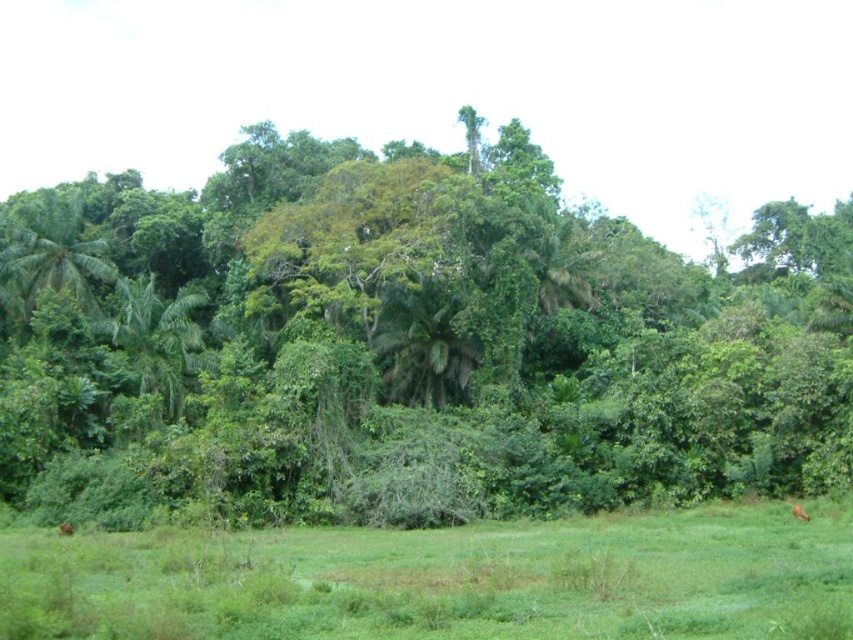
Question: Which of the following is the farthest from the observer?

Choices:
 (A) green grassy field at lower center
 (B) green leafy tree at center

Answer: (B)

Question: Which of the following is the closest to the observer?

Choices:
 (A) (332, 609)
 (B) (722, 342)

Answer: (A)

Question: Does green leafy tree at center have a larger size compared to green grassy field at lower center?

Choices:
 (A) no
 (B) yes

Answer: (B)

Question: Is green leafy tree at center in front of green grassy field at lower center?

Choices:
 (A) no
 (B) yes

Answer: (A)

Question: Does green leafy tree at center appear under green grassy field at lower center?

Choices:
 (A) yes
 (B) no

Answer: (B)